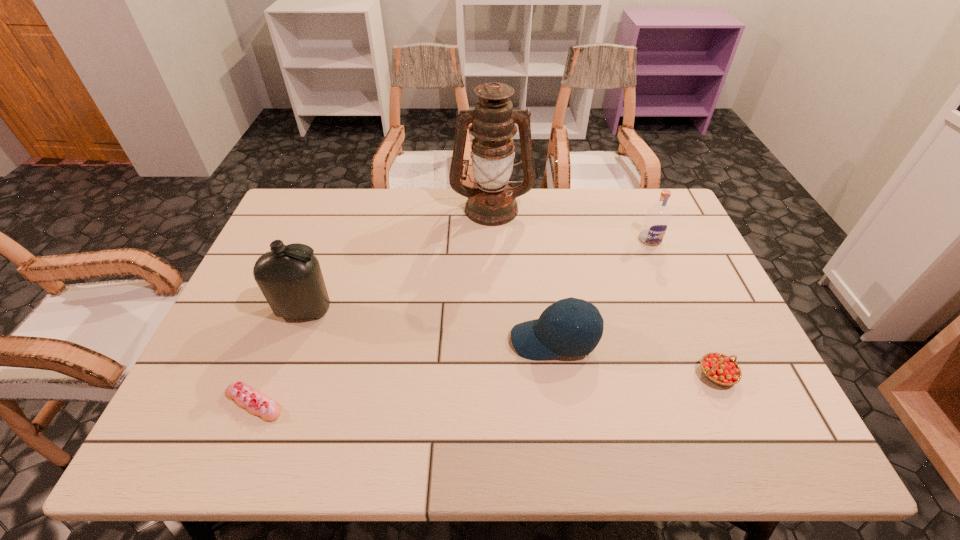
Where is `vacant space located on the label of the vodka`? This screenshot has width=960, height=540. vacant space located on the label of the vodka is located at coordinates click(699, 355).

Find the location of a particular element. Image resolution: width=960 pixels, height=540 pixels. free space located 0.330m on the front-facing side of the fourth tallest object is located at coordinates (375, 340).

The width and height of the screenshot is (960, 540). What are the coordinates of `vacant area situated on the front-facing side of the fourth tallest object` in the screenshot? It's located at (347, 340).

Image resolution: width=960 pixels, height=540 pixels. Identify the location of vacant space positioned on the front-facing side of the fourth tallest object. (437, 340).

Find the location of a particular element. The width and height of the screenshot is (960, 540). vacant area located 0.240m on the left of the strawberry is located at coordinates (593, 375).

Identify the location of free space located on the back of the shortest object. (303, 280).

Where is `lantern that is at the far edge`? This screenshot has height=540, width=960. lantern that is at the far edge is located at coordinates pyautogui.click(x=491, y=202).

The image size is (960, 540). I want to click on vodka present at the far edge, so click(x=656, y=221).

At what (x,y) coordinates should I click in order to perform the action: click on object that is at the near edge. Please return your answer as a coordinate pair (x, y). This screenshot has height=540, width=960. Looking at the image, I should click on pos(247,397).

Find the location of a particular element. This screenshot has width=960, height=540. bottle that is at the left edge is located at coordinates (289, 276).